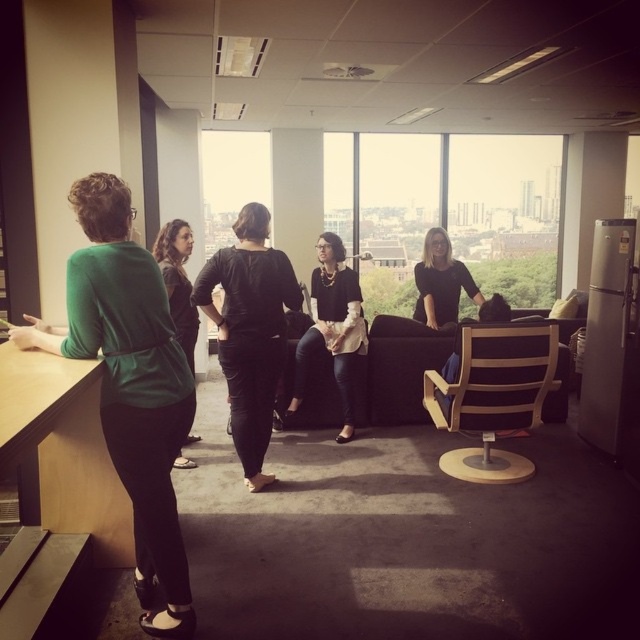
Is point (83, 268) closer to viewer compared to point (429, 280)?

Yes, it is.

Is point (109, 266) farther from camera compared to point (442, 289)?

No, it is in front of (442, 289).

Image resolution: width=640 pixels, height=640 pixels. What are the coordinates of `green matte blouse at left` in the screenshot? It's located at (129, 385).

Where is `green matte blouse at left`? The height and width of the screenshot is (640, 640). green matte blouse at left is located at coordinates (129, 385).

Which is more to the left, matte black shirt at center or matte green sweater at left?

Positioned to the left is matte green sweater at left.

What do you see at coordinates (440, 282) in the screenshot?
I see `matte black shirt at center` at bounding box center [440, 282].

Locate an element on the screen. matte black shirt at center is located at coordinates (440, 282).

Based on the photo, is black matte/black pants at center bigger than matte black shirt at center?

Correct, black matte/black pants at center is larger in size than matte black shirt at center.

In the scene shown: Can you confirm if black matte/black pants at center is shorter than matte black shirt at center?

No, black matte/black pants at center is not shorter than matte black shirt at center.

Between point (250, 333) and point (445, 237), which one is positioned in front?

Point (250, 333)

Find the location of a particular element. The height and width of the screenshot is (640, 640). black matte/black pants at center is located at coordinates (250, 330).